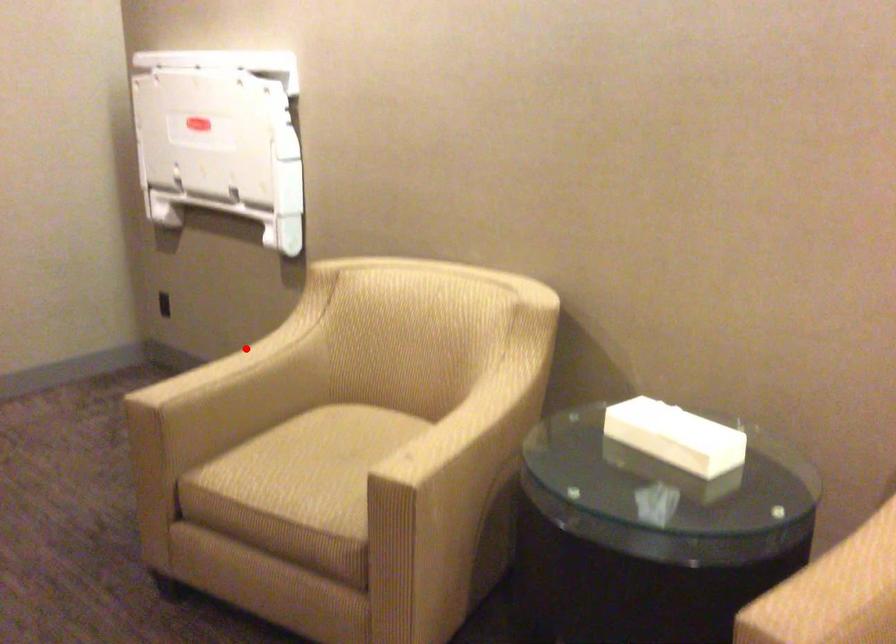
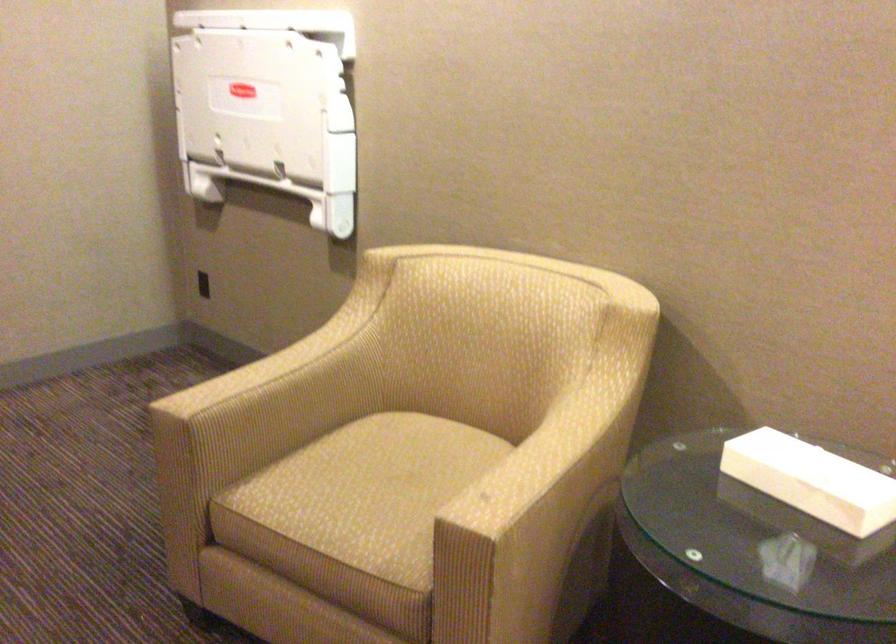
Find the pixel in the second image that matches the highlighted location in the first image.

(289, 346)